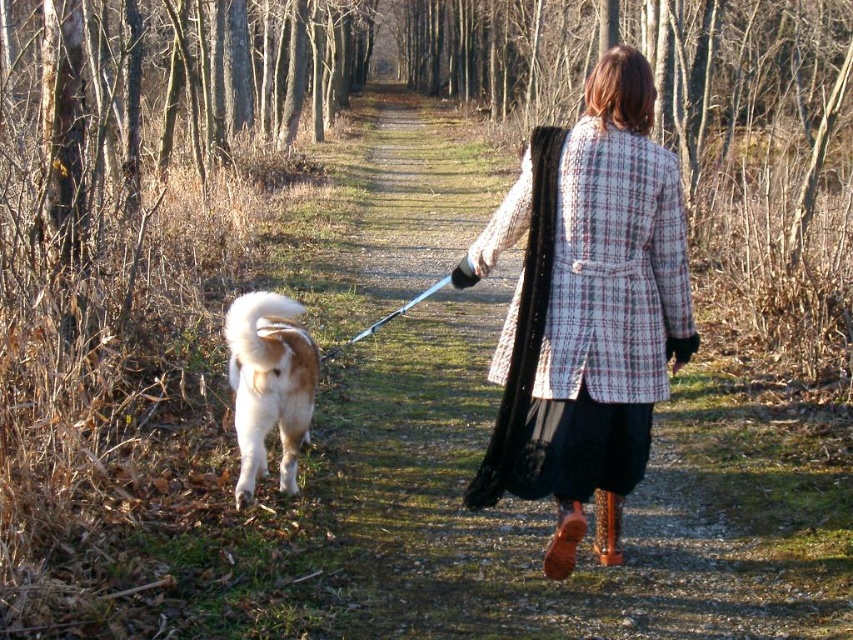
You are a hiker planning to walk your dog on the gravel path at center. You notice the fluffy white fur at lower left, which is part of the dog. Since the path is narrow, can you determine if the path is wide enough to walk your dog without stepping off the path?

The gravel path at center is wider than the fluffy white fur at lower left, so yes, the path is wide enough to walk your dog without stepping off the path.